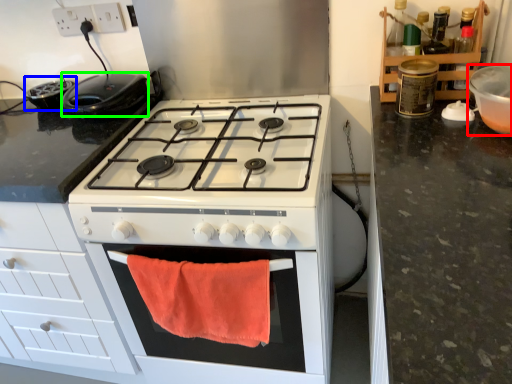
Question: Which object is the closest to the appliance (highlighted by a red box)? Choose among these: appliance (highlighted by a blue box) or kitchen appliance (highlighted by a green box).

Choices:
 (A) appliance
 (B) kitchen appliance

Answer: (B)